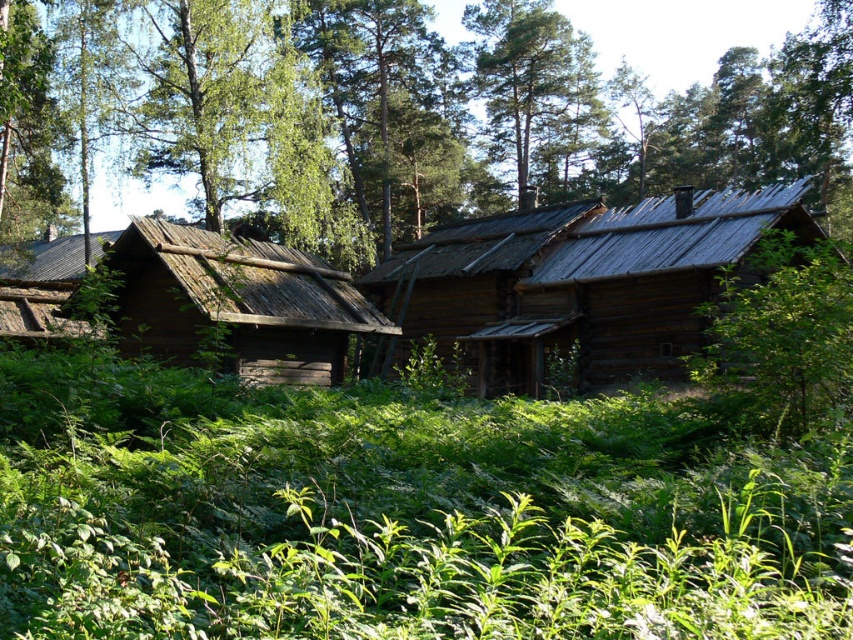
You are standing in the forest near the rustic wooden structure. You see a point marked at coordinates (401, 513). What is located at that point?

The point at coordinates (401, 513) corresponds to green leafy grass at center.

You are standing at the entrance of the rustic wooden structure and looking towards the forest. Where is the green leafy grass at center located in relation to your position?

The green leafy grass at center is located at point (401, 513) in relation to your position.